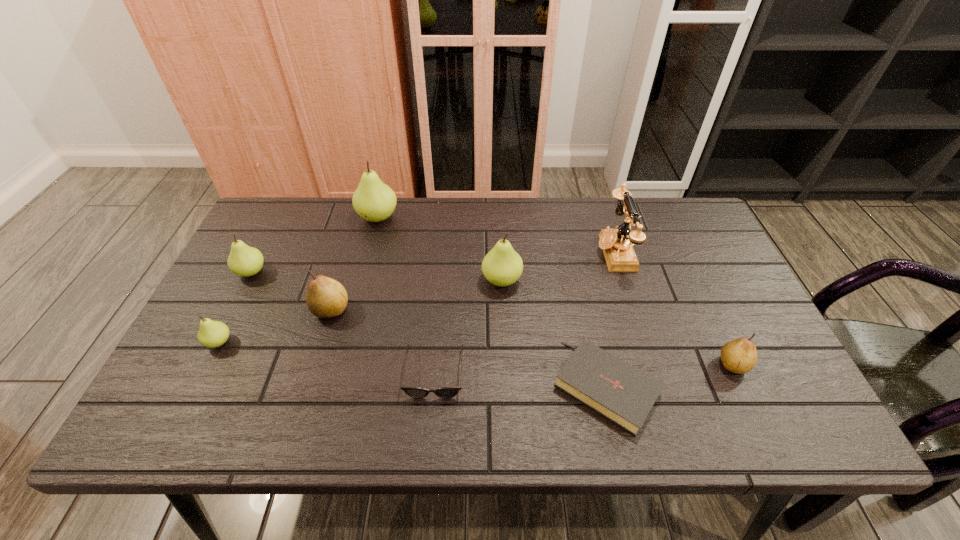
This screenshot has height=540, width=960. Find the location of `unoccupied area between the biggest green pear and the nearest green pear`. unoccupied area between the biggest green pear and the nearest green pear is located at coordinates (299, 280).

The height and width of the screenshot is (540, 960). I want to click on unoccupied area between the third biggest green pear and the Bible, so click(429, 329).

Where is `free area in between the sunglasses and the telephone`? free area in between the sunglasses and the telephone is located at coordinates click(524, 312).

You are a GUI agent. You are given a task and a screenshot of the screen. Output one action in this format:
    pyautogui.click(x=<x>, y=<y>)
    Task: Click on the free area in between the smallest green pear and the second green pear from right to left
    The height and width of the screenshot is (540, 960).
    Given the screenshot: What is the action you would take?
    pyautogui.click(x=299, y=280)

This screenshot has height=540, width=960. What are the coordinates of `free point between the smallest green pear and the left brown pear` in the screenshot? It's located at click(x=276, y=326).

This screenshot has height=540, width=960. What are the coordinates of `free space between the nearest green pear and the tallest pear` in the screenshot? It's located at (299, 280).

This screenshot has width=960, height=540. What are the coordinates of `object that stands as the fifth closest to the telephone` in the screenshot? It's located at (374, 201).

Find the location of a particular element. Image resolution: width=960 pixels, height=540 pixels. the sixth closest object to the third biggest green pear is located at coordinates (620, 392).

Locate an element on the screen. the fourth closest pear to the sunglasses is located at coordinates (374, 201).

You are a GUI agent. You are given a task and a screenshot of the screen. Output one action in this format:
    pyautogui.click(x=<x>, y=<y>)
    Task: Click on the pear that is the closest to the sunglasses
    This screenshot has height=540, width=960.
    Given the screenshot: What is the action you would take?
    pyautogui.click(x=502, y=266)